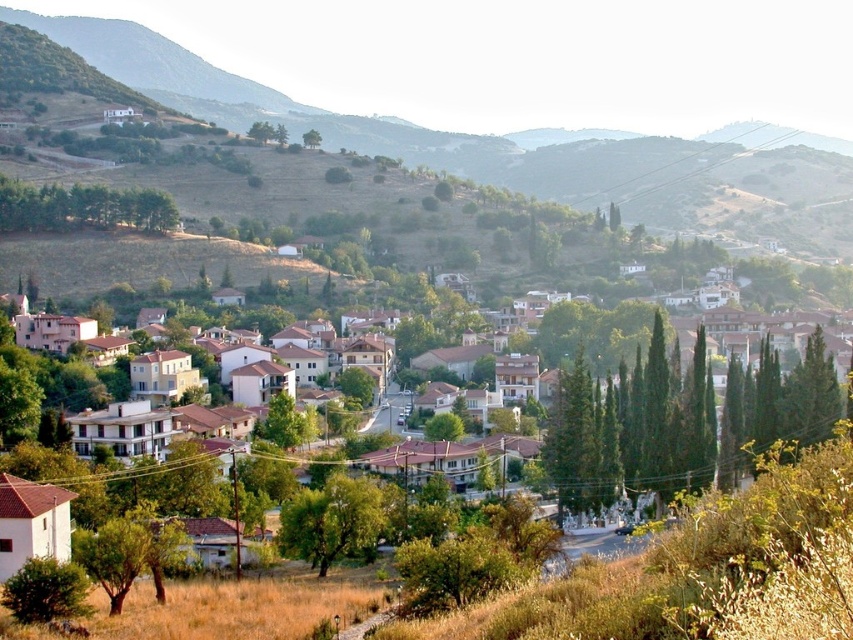
Which is behind, point (805, 372) or point (358, 497)?

Point (805, 372)

Is point (555, 419) behind point (380, 522)?

Yes, point (555, 419) is behind point (380, 522).

Identify the location of green textured trees at center. coord(631,428).

Is green textured trees at center to the left of green leafy trees at upper left from the viewer's perspective?

Incorrect, green textured trees at center is not on the left side of green leafy trees at upper left.

Can you confirm if green textured trees at center is bigger than green leafy trees at upper left?

Yes, green textured trees at center is bigger than green leafy trees at upper left.

I want to click on green textured trees at center, so click(631, 428).

You are a GUI agent. You are given a task and a screenshot of the screen. Output one action in this format:
    pyautogui.click(x=<x>, y=<y>)
    Task: Click on the green textured trees at center
    
    Given the screenshot: What is the action you would take?
    pyautogui.click(x=631, y=428)

Measure the distance between point (199, 81) and camera.

644.00 meters

Does green grassy hillside at upper left have a lesser width compared to green leafy tree at center?

No, green grassy hillside at upper left is not thinner than green leafy tree at center.

At what (x,y) coordinates should I click in order to perform the action: click on green grassy hillside at upper left. Please return your answer as a coordinate pair (x, y). The width and height of the screenshot is (853, 640). Looking at the image, I should click on (523, 147).